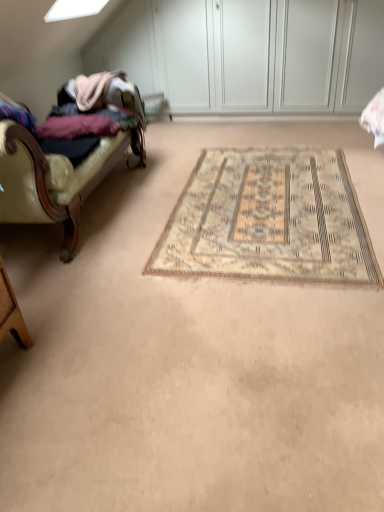
Question: Does leather couch at left have a lesser width compared to beige woven rug at center?

Choices:
 (A) no
 (B) yes

Answer: (B)

Question: Can you confirm if leather couch at left is wider than beige woven rug at center?

Choices:
 (A) no
 (B) yes

Answer: (A)

Question: Is leather couch at left with beige woven rug at center?

Choices:
 (A) no
 (B) yes

Answer: (A)

Question: From a real-world perspective, is leather couch at left below beige woven rug at center?

Choices:
 (A) yes
 (B) no

Answer: (B)

Question: Could you tell me if leather couch at left is turned towards beige woven rug at center?

Choices:
 (A) yes
 (B) no

Answer: (A)

Question: From a real-world perspective, is leather couch at left located higher than beige woven rug at center?

Choices:
 (A) no
 (B) yes

Answer: (B)

Question: From the image's perspective, would you say beige woven rug at center is shown under leather couch at left?

Choices:
 (A) no
 (B) yes

Answer: (B)

Question: Would you say beige woven rug at center is a long distance from leather couch at left?

Choices:
 (A) yes
 (B) no

Answer: (B)

Question: Can you confirm if beige woven rug at center is thinner than leather couch at left?

Choices:
 (A) yes
 (B) no

Answer: (B)

Question: Is beige woven rug at center turned away from leather couch at left?

Choices:
 (A) yes
 (B) no

Answer: (B)

Question: Is beige woven rug at center completely or partially outside of leather couch at left?

Choices:
 (A) yes
 (B) no

Answer: (A)

Question: Can you confirm if beige woven rug at center is shorter than leather couch at left?

Choices:
 (A) yes
 (B) no

Answer: (A)

Question: From the image's perspective, is beige woven rug at center above or below leather couch at left?

Choices:
 (A) below
 (B) above

Answer: (A)